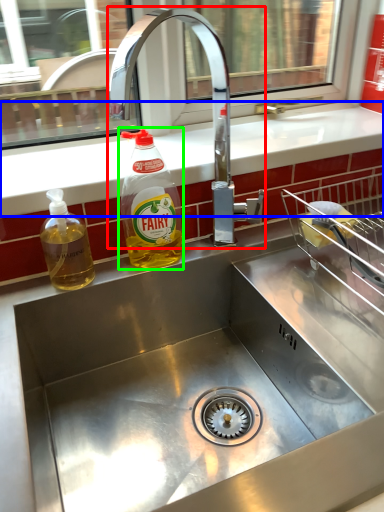
Question: Which object is positioned closest to tap (highlighted by a red box)? Select from counter top (highlighted by a blue box) and bottle (highlighted by a green box).

Choices:
 (A) counter top
 (B) bottle

Answer: (A)